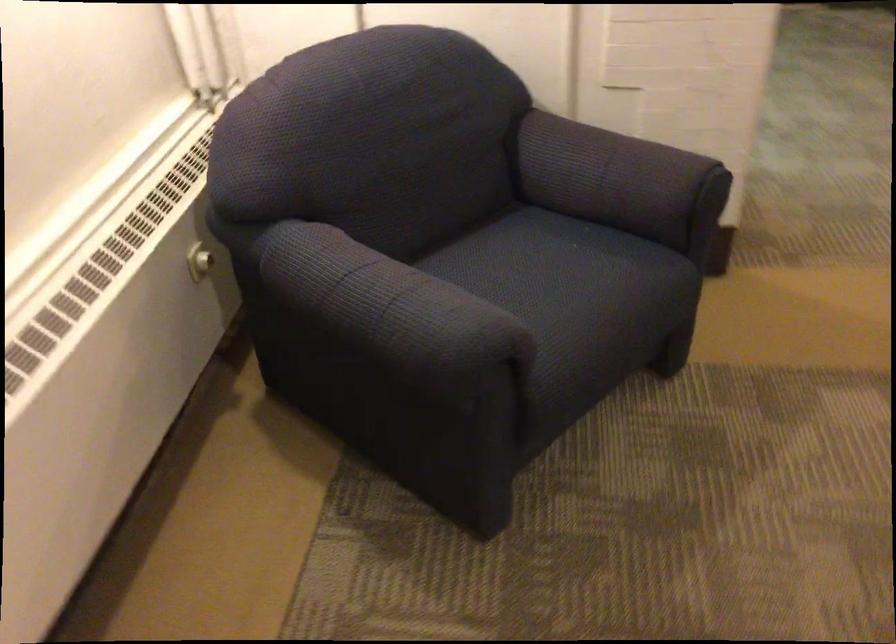
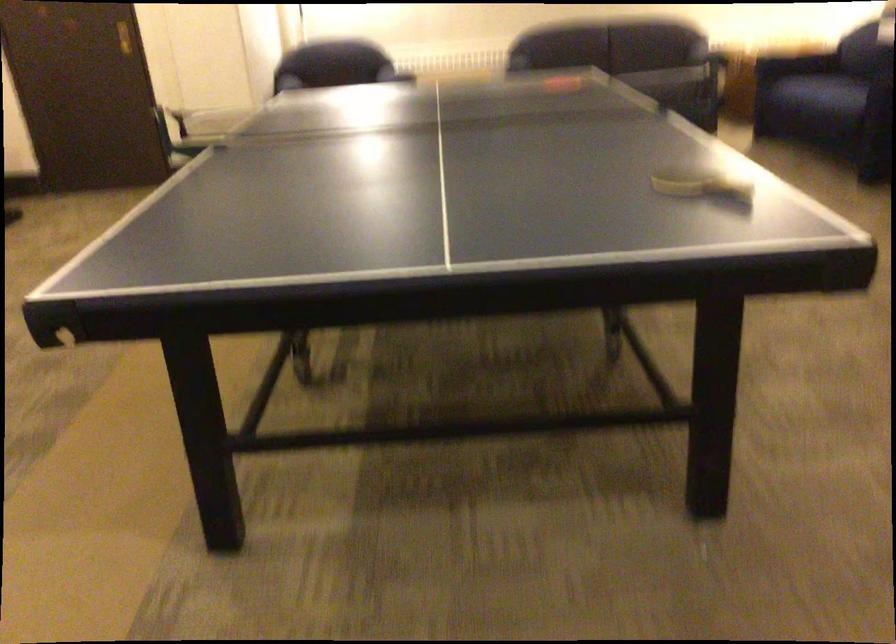
The first image is from the beginning of the video and the second image is from the end. How did the camera likely rotate when shooting the video?

The camera's rotation is toward right-down.